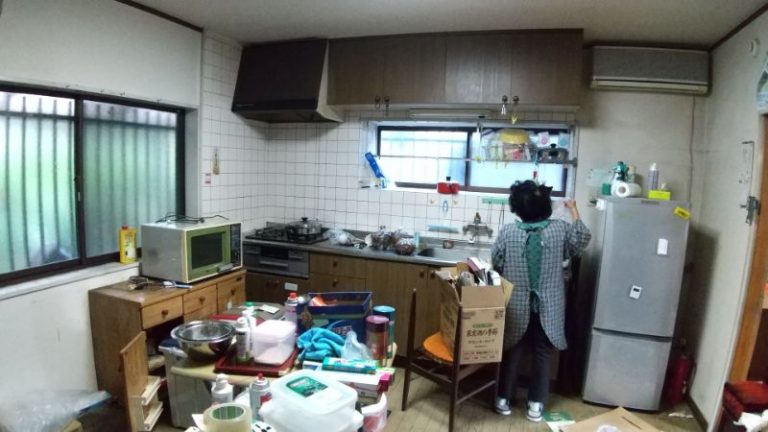
You are a GUI agent. You are given a task and a screenshot of the screen. Output one action in this format:
    pyautogui.click(x=<x>, y=<y>)
    Task: Click on the chair
    This screenshot has height=432, width=768.
    Given the screenshot: What is the action you would take?
    pyautogui.click(x=435, y=340)